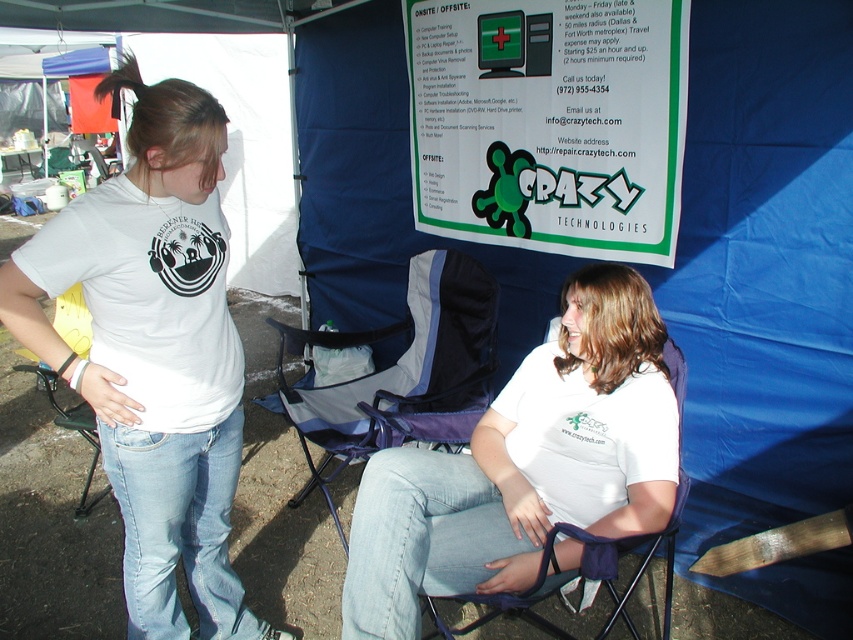
Which is behind, point (392, 596) or point (136, 305)?

The point (392, 596) is behind.

Which is above, white cotton shirt at center or white matte t-shirt at left?

white matte t-shirt at left is above.

Between point (451, 468) and point (149, 228), which one is positioned behind?

The point (451, 468) is behind.

Find the location of a particular element. white cotton shirt at center is located at coordinates (524, 465).

Can you confirm if blue fabric chair at center is shorter than brown hair at upper left?

No, blue fabric chair at center is not shorter than brown hair at upper left.

Between point (323, 426) and point (117, 74), which one is positioned in front?

Point (117, 74) is in front.

This screenshot has width=853, height=640. Find the location of `blue fabric chair at center`. blue fabric chair at center is located at coordinates (399, 372).

Locate an element on the screen. Image resolution: width=853 pixels, height=640 pixels. blue fabric chair at center is located at coordinates (399, 372).

Does white matte t-shirt at left appear under brown hair at upper left?

Yes, white matte t-shirt at left is below brown hair at upper left.

Is point (222, 305) in front of point (138, 96)?

No.

Image resolution: width=853 pixels, height=640 pixels. Find the location of `white matte t-shirt at left`. white matte t-shirt at left is located at coordinates (148, 298).